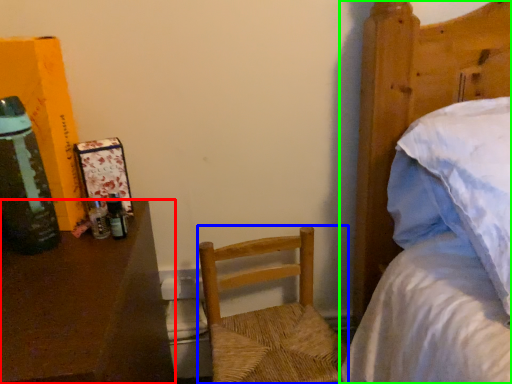
Question: Which is nearer to the desk (highlighted by a red box)? chair (highlighted by a blue box) or bed (highlighted by a green box).

Choices:
 (A) chair
 (B) bed

Answer: (A)